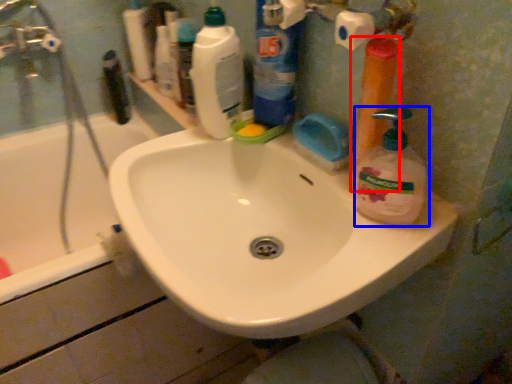
Question: Which point is closer to the camera, cleaning product (highlighted by a red box) or cleaning product (highlighted by a blue box)?

Choices:
 (A) cleaning product
 (B) cleaning product

Answer: (B)